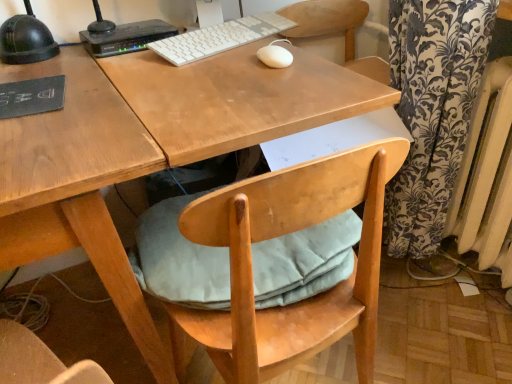
Image resolution: width=512 pixels, height=384 pixels. What are the coordinates of `free location to the left of white matte mouse at center` in the screenshot? It's located at (201, 63).